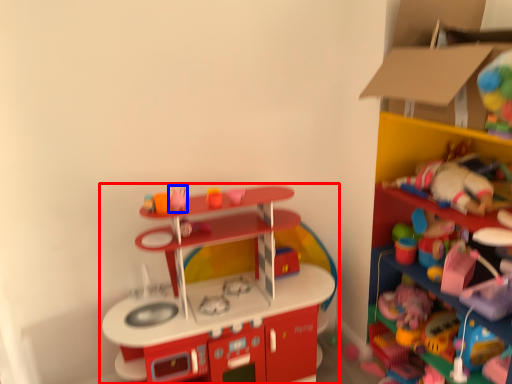
Question: Which of the following is the closest to the observer, toy (highlighted by a red box) or toy (highlighted by a blue box)?

Choices:
 (A) toy
 (B) toy

Answer: (A)